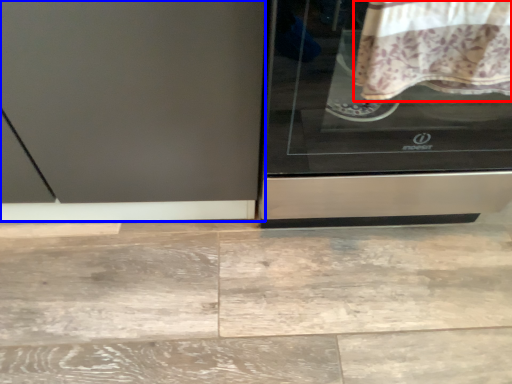
Question: Which of the following is the farthest to the observer, blanket (highlighted by a red box) or screen door (highlighted by a blue box)?

Choices:
 (A) blanket
 (B) screen door

Answer: (B)